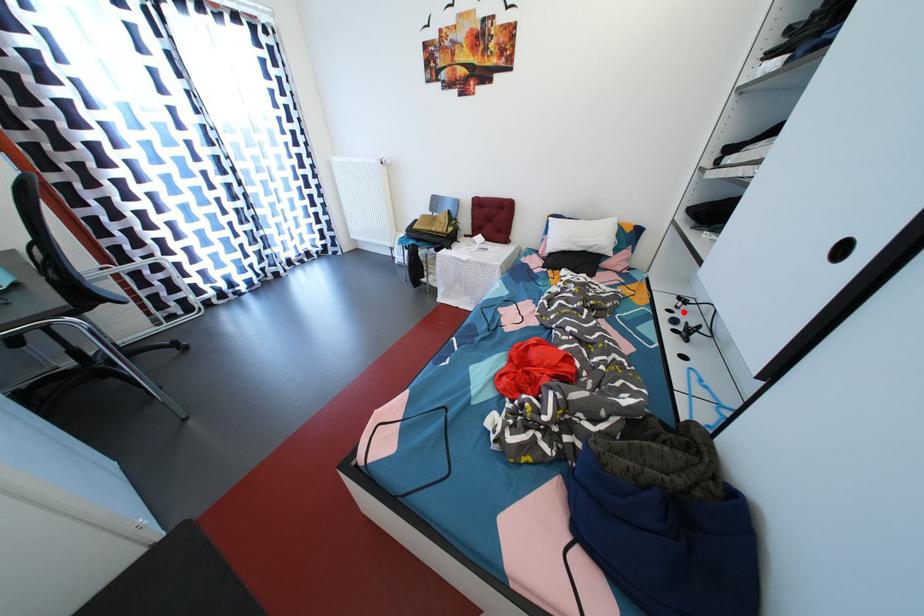
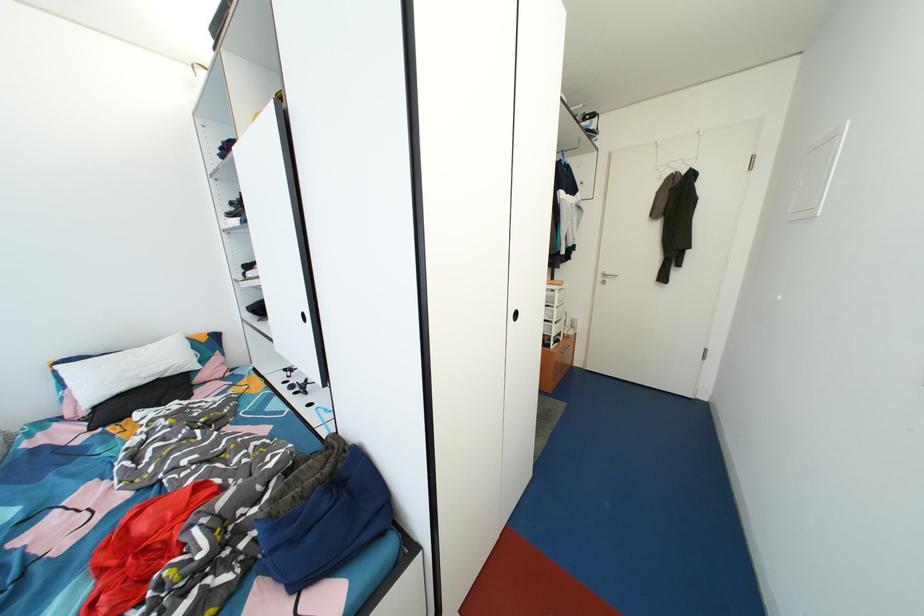
Question: I am providing you with two images of the same scene from different viewpoints. Image1 has a red point marked. In image2, the corresponding 3D location appears at what relative position? Reply with the corresponding letter.

Choices:
 (A) Closer
 (B) Farther

Answer: (B)